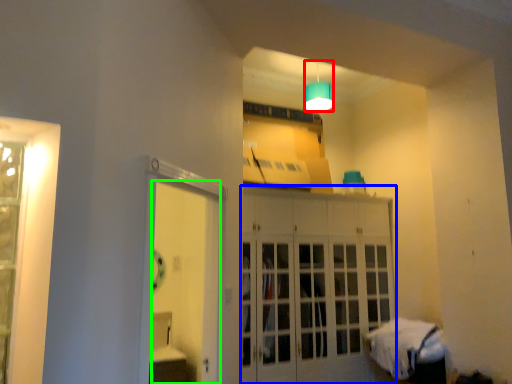
Question: Which object is the closest to the lamp (highlighted by a red box)? Choose among these: cabinetry (highlighted by a blue box) or door (highlighted by a green box).

Choices:
 (A) cabinetry
 (B) door

Answer: (A)